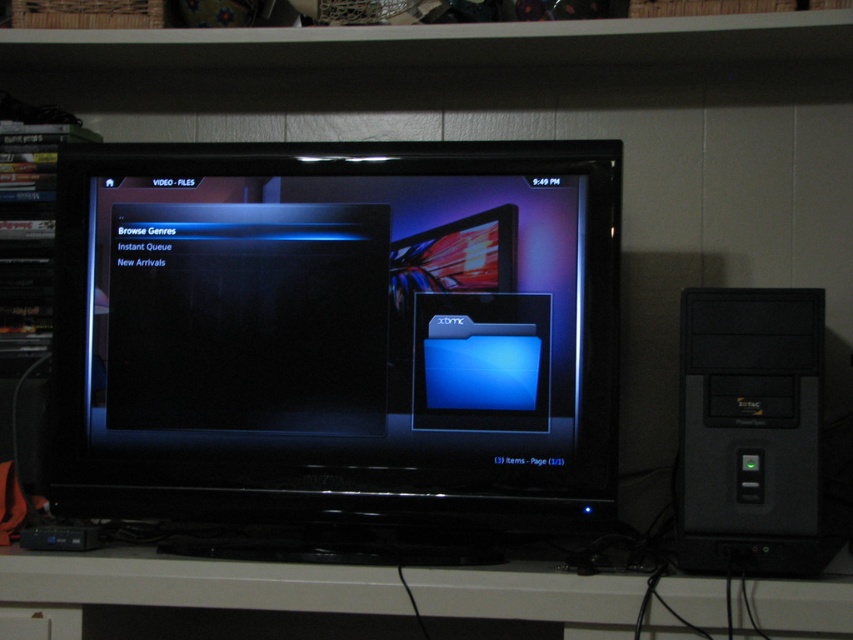
Question: Where is white matte computer desk at lower center located in relation to black plastic desktop computer at right in the image?

Choices:
 (A) below
 (B) above

Answer: (A)

Question: Which object appears closest to the camera in this image?

Choices:
 (A) white matte computer desk at lower center
 (B) black plastic desktop computer at right
 (C) black glossy monitor at center

Answer: (A)

Question: Which point is farther to the camera?

Choices:
 (A) 461,580
 (B) 755,564
 (C) 73,234

Answer: (C)

Question: Does black glossy monitor at center lie behind white matte computer desk at lower center?

Choices:
 (A) yes
 (B) no

Answer: (A)

Question: Among these objects, which one is nearest to the camera?

Choices:
 (A) black glossy monitor at center
 (B) black plastic desktop computer at right
 (C) white matte computer desk at lower center

Answer: (C)

Question: Does white matte computer desk at lower center have a lesser width compared to black plastic desktop computer at right?

Choices:
 (A) no
 (B) yes

Answer: (A)